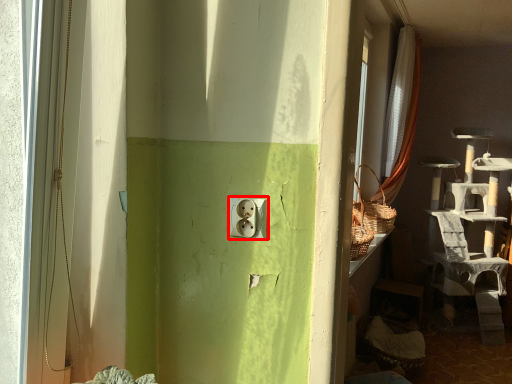
Question: From the image's perspective, considering the relative positions of electric outlet (annotated by the red box) and curtain in the image provided, where is electric outlet (annotated by the red box) located with respect to the staircase?

Choices:
 (A) above
 (B) below

Answer: (B)